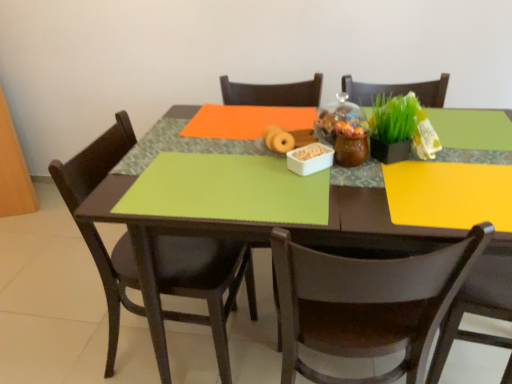
This screenshot has height=384, width=512. What are the coordinates of `vacant region to the left of matte brown donut at center` in the screenshot? It's located at (229, 144).